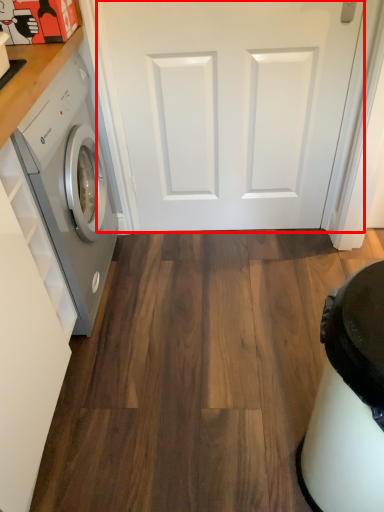
Question: Where is door (annotated by the red box) located in relation to washing machine in the image?

Choices:
 (A) left
 (B) right

Answer: (B)